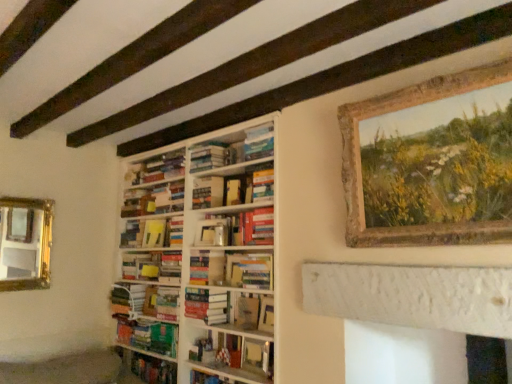
Question: In which direction should I rotate to look at hardcover book at center, acting as the fourth book starting from the bottom?

Choices:
 (A) left
 (B) right

Answer: (A)

Question: Is hardcover book at center, the 8th book viewed from the top, a part of wooden rustic frame at upper right?

Choices:
 (A) yes
 (B) no

Answer: (B)

Question: Is wooden rustic frame at upper right further to camera compared to hardcover book at center, the 8th book viewed from the top?

Choices:
 (A) no
 (B) yes

Answer: (A)

Question: Can you confirm if wooden rustic frame at upper right is wider than hardcover book at center, the 8th book viewed from the top?

Choices:
 (A) no
 (B) yes

Answer: (A)

Question: Is wooden rustic frame at upper right placed right next to hardcover book at center, positioned as the 2th book in bottom-to-top order?

Choices:
 (A) no
 (B) yes

Answer: (A)

Question: Is wooden rustic frame at upper right to the left of hardcover book at center, the 8th book viewed from the top, from the viewer's perspective?

Choices:
 (A) yes
 (B) no

Answer: (B)

Question: Are wooden rustic frame at upper right and hardcover book at center, positioned as the 2th book in bottom-to-top order, located far from each other?

Choices:
 (A) no
 (B) yes

Answer: (B)

Question: Is hardcover book at center, which appears as the first paperback book when ordered from the bottom, at the right side of hardcover book at center, positioned as the fifth book in bottom-to-top order?

Choices:
 (A) no
 (B) yes

Answer: (B)

Question: Is hardcover book at center, the 6th paperback book from the top, closer to camera compared to hardcover book at center, positioned as the fifth book in bottom-to-top order?

Choices:
 (A) yes
 (B) no

Answer: (A)

Question: Is hardcover book at center, which appears as the first paperback book when ordered from the bottom, placed right next to hardcover book at center, which ranks as the 5th book in top-to-bottom order?

Choices:
 (A) no
 (B) yes

Answer: (A)

Question: Considering the relative sizes of hardcover book at center, the 6th paperback book from the top, and hardcover book at center, positioned as the fifth book in bottom-to-top order, in the image provided, is hardcover book at center, the 6th paperback book from the top, smaller than hardcover book at center, positioned as the fifth book in bottom-to-top order,?

Choices:
 (A) yes
 (B) no

Answer: (A)

Question: Considering the relative sizes of hardcover book at center, which appears as the first paperback book when ordered from the bottom, and hardcover book at center, which ranks as the 5th book in top-to-bottom order, in the image provided, is hardcover book at center, which appears as the first paperback book when ordered from the bottom, wider than hardcover book at center, which ranks as the 5th book in top-to-bottom order,?

Choices:
 (A) yes
 (B) no

Answer: (B)

Question: Is hardcover book at center, which appears as the first paperback book when ordered from the bottom, oriented away from hardcover book at center, positioned as the fifth book in bottom-to-top order?

Choices:
 (A) no
 (B) yes

Answer: (A)

Question: From a real-world perspective, is hardcover book at center, the 3th book from the top, positioned under matte white vase at center, the 4th book positioned from the top, based on gravity?

Choices:
 (A) no
 (B) yes

Answer: (A)